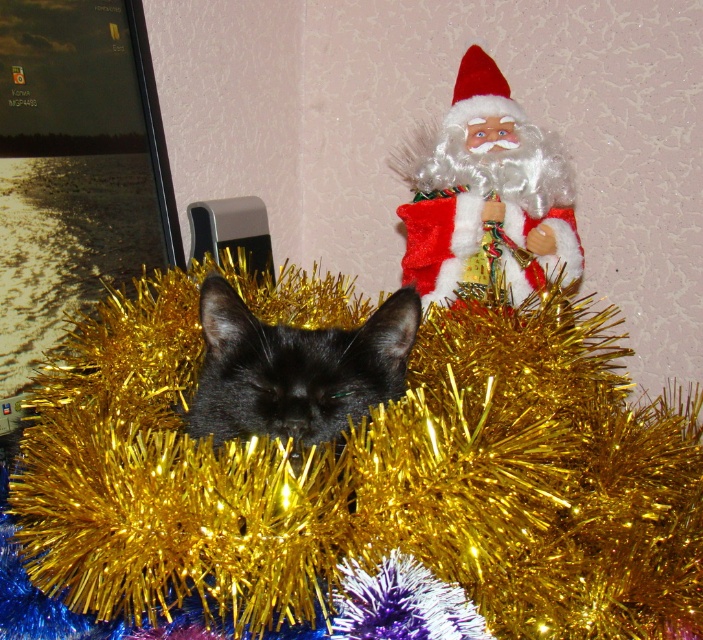
You are a photographer trying to capture the gold tinsel at center and the fuzzy white santa at upper right in a single frame. Based on their positions, which object is closer to the camera?

The gold tinsel at center is positioned under fuzzy white santa at upper right, which means the fuzzy white santa at upper right is closer to the camera than the gold tinsel at center.

You are a photographer trying to capture the black shiny cat at center surrounded by the gold tinsel at center. Based on the scene, which object is taller and would require adjusting your camera angle to focus on the top part?

The gold tinsel at center is taller than the black shiny cat at center, so you should adjust your camera angle to focus on the top part of the gold tinsel at center.